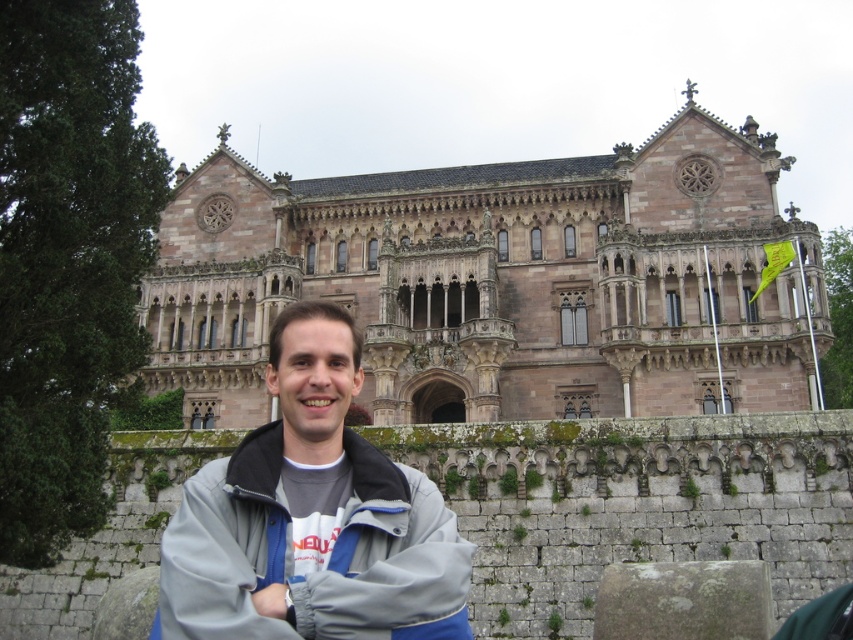
You are standing in front of a historic Gothic building and notice a point marked at coordinates (311, 516). According to the image, where is this point located?

The point at (311, 516) is located on the gray fleece jacket at center.

Consider the image. You are standing at the location of the gray fleece jacket at center and want to take a photo of the brown stone building at center. The camera you have can focus on objects up to 40 meters away. Will the building be in focus?

The distance between the brown stone building at center and the gray fleece jacket at center is 40.33 meters. Since the camera can only focus up to 40 meters, the building will be slightly out of focus.

You are standing in front of a historic site and want to take a photo of the brown stone building at center. According to the coordinates provided, where exactly is the brown stone building located in the image?

The brown stone building at center is located at coordinates point (500, 282).